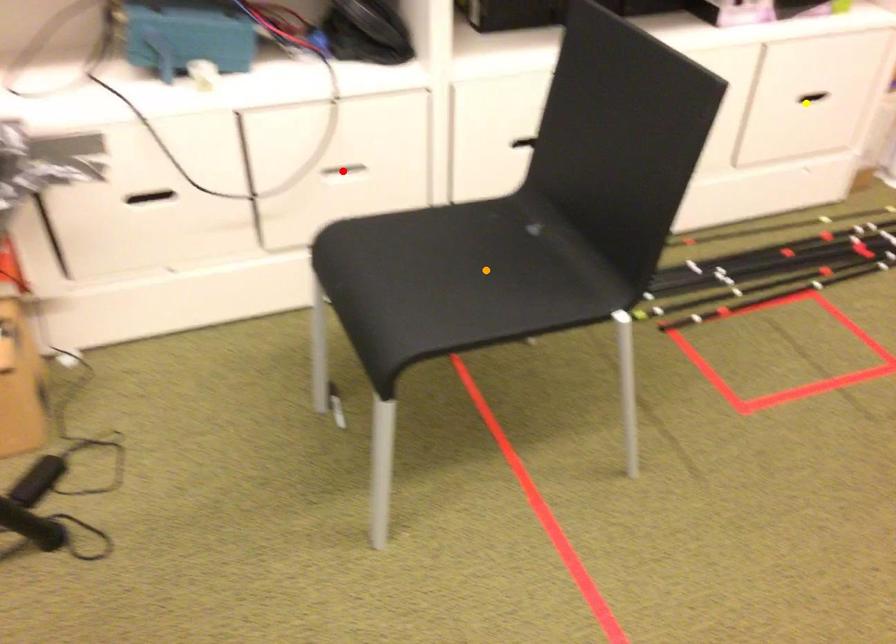
Order these from nearest to farthest:
red point
yellow point
orange point

yellow point, red point, orange point